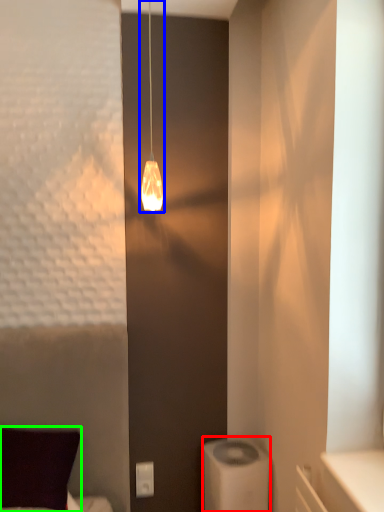
Question: Considering the real-world distances, which object is closest to appliance (highlighted by a red box)? lamp (highlighted by a blue box) or pillow (highlighted by a green box).

Choices:
 (A) lamp
 (B) pillow

Answer: (B)